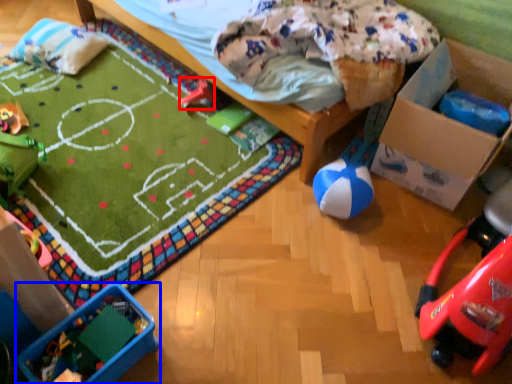
Question: Which of the following is the closest to the observer, toy (highlighted by a red box) or toy (highlighted by a blue box)?

Choices:
 (A) toy
 (B) toy

Answer: (B)